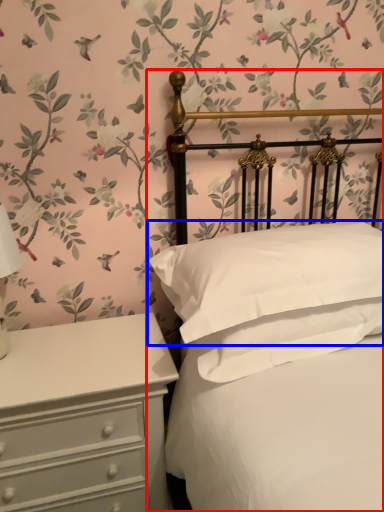
Question: Which object appears closest to the camera in this image, bed (highlighted by a red box) or pillow (highlighted by a blue box)?

Choices:
 (A) bed
 (B) pillow

Answer: (A)